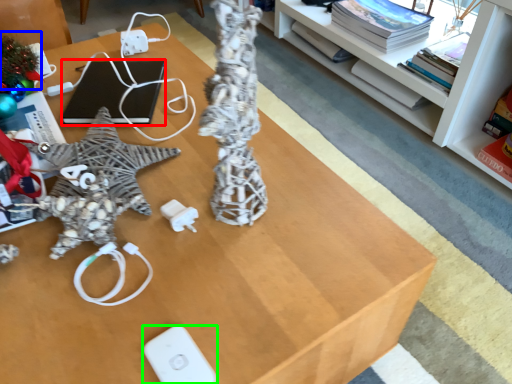
Question: Based on their relative distances, which object is farther from laptop (highlighted by a red box)? Choose from christmas decoration (highlighted by a blue box) and Wii controller (highlighted by a green box).

Choices:
 (A) christmas decoration
 (B) Wii controller

Answer: (B)